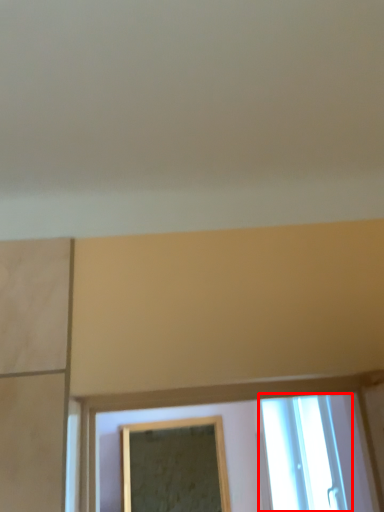
Question: From the image, what is the correct spatial relationship of window (annotated by the red box) in relation to mirror?

Choices:
 (A) left
 (B) right

Answer: (B)